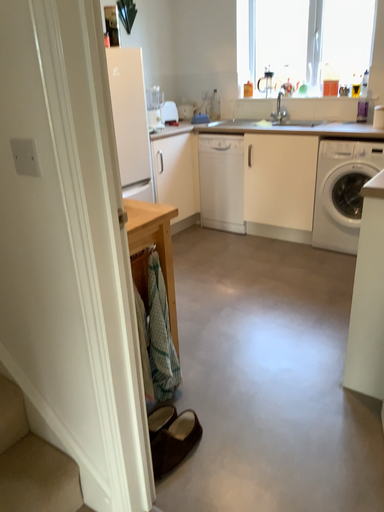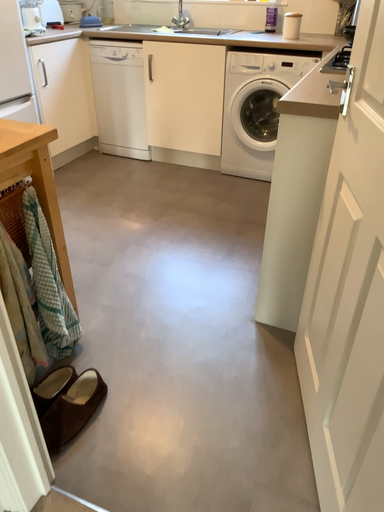
Question: Which way did the camera rotate in the video?

Choices:
 (A) rotated downward
 (B) rotated upward

Answer: (A)